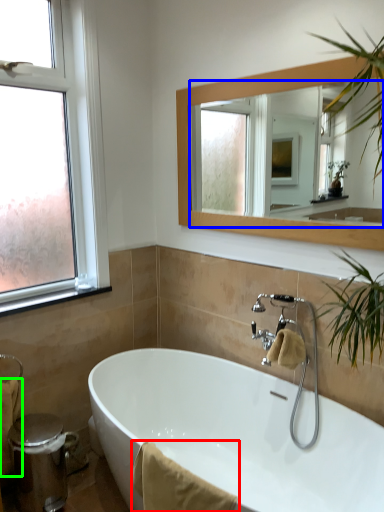
Question: Which is farther away from bath towel (highlighted by a red box)? mirror (highlighted by a blue box) or bath towel (highlighted by a green box)?

Choices:
 (A) mirror
 (B) bath towel

Answer: (A)